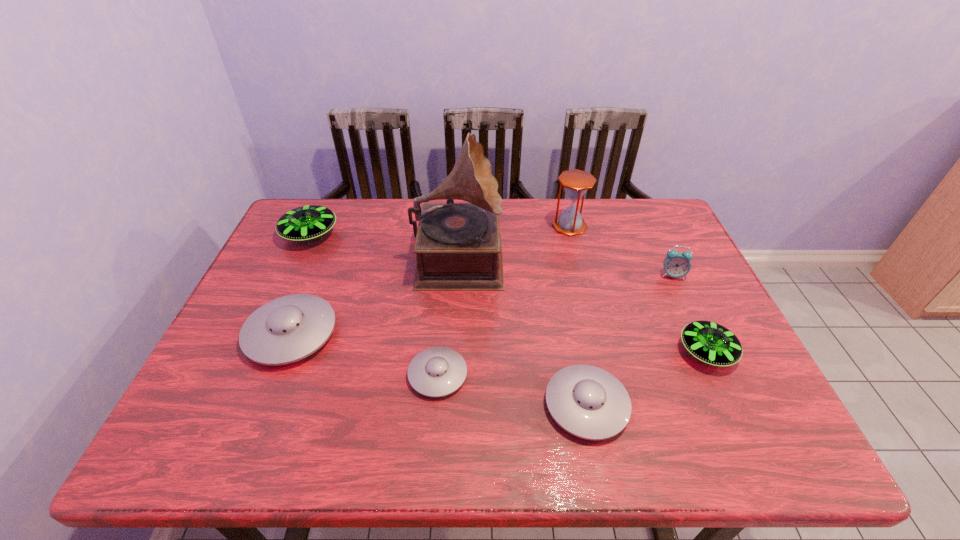
This screenshot has width=960, height=540. In the image, there is a desktop. Find the location of `vacant space at the left edge`. vacant space at the left edge is located at coordinates (227, 363).

Locate an element on the screen. This screenshot has width=960, height=540. free space at the far right corner of the desktop is located at coordinates (653, 198).

The height and width of the screenshot is (540, 960). Find the location of `vacant area that lies between the alarm clock and the rightmost saucer`. vacant area that lies between the alarm clock and the rightmost saucer is located at coordinates (689, 313).

Locate an element on the screen. This screenshot has height=540, width=960. vacant space that is in between the leftmost gray saucer and the bigger green saucer is located at coordinates (300, 284).

The image size is (960, 540). Identify the location of free point between the second smallest gray saucer and the shortest saucer. (512, 390).

The image size is (960, 540). Find the location of `vacant region between the biggest gray saucer and the tallest object`. vacant region between the biggest gray saucer and the tallest object is located at coordinates (375, 294).

Find the location of `free space between the brown hourglass and the tallest object`. free space between the brown hourglass and the tallest object is located at coordinates pos(515,240).

Locate an element on the screen. This screenshot has width=960, height=540. empty location between the rightmost saucer and the smallest gray saucer is located at coordinates (572, 363).

The height and width of the screenshot is (540, 960). I want to click on the sixth closest object to the biggest gray saucer, so click(709, 342).

Identify which object is located as the sixth nearest to the biggest gray saucer. Please provide its 2D coordinates. Your answer should be formatted as a tuple, i.e. [(x, y)], where the tuple contains the x and y coordinates of a point satisfying the conditions above.

[(709, 342)]